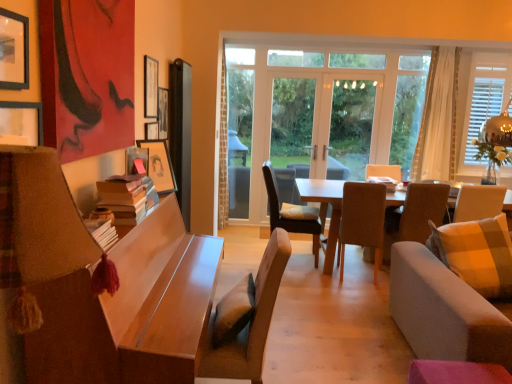
Question: Is white sheer curtain at right positioned in front of wooden picture frame at upper center, positioned as the fourth picture frame in front-to-back order?

Choices:
 (A) no
 (B) yes

Answer: (A)

Question: Does white sheer curtain at right lie behind wooden picture frame at upper center, positioned as the fourth picture frame in front-to-back order?

Choices:
 (A) yes
 (B) no

Answer: (A)

Question: Is white sheer curtain at right located outside wooden picture frame at upper center, positioned as the fourth picture frame in front-to-back order?

Choices:
 (A) yes
 (B) no

Answer: (A)

Question: Does white sheer curtain at right contain wooden picture frame at upper center, which ranks as the 1th picture frame in back-to-front order?

Choices:
 (A) yes
 (B) no

Answer: (B)

Question: Can you confirm if white sheer curtain at right is shorter than wooden picture frame at upper center, positioned as the fourth picture frame in front-to-back order?

Choices:
 (A) no
 (B) yes

Answer: (A)

Question: From a real-world perspective, is white wooden window at right, arranged as the second window when viewed from the left, positioned above or below wooden table at center, the 1th table from the back?

Choices:
 (A) below
 (B) above

Answer: (B)

Question: Is white wooden window at right, which ranks as the first window in right-to-left order, taller or shorter than wooden table at center, the 2th table from the front?

Choices:
 (A) tall
 (B) short

Answer: (A)

Question: Looking at the image, does white wooden window at right, arranged as the second window when viewed from the left, seem bigger or smaller compared to wooden table at center, the 1th table from the back?

Choices:
 (A) big
 (B) small

Answer: (B)

Question: Would you say white wooden window at right, arranged as the second window when viewed from the left, is inside or outside wooden table at center, which is counted as the second table, starting from the left?

Choices:
 (A) inside
 (B) outside

Answer: (B)

Question: Is wooden table at center, which is counted as the 1th table, starting from the right, to the left or to the right of white wooden window at right, arranged as the second window when viewed from the left, in the image?

Choices:
 (A) left
 (B) right

Answer: (A)

Question: Is point (306, 193) closer or farther from the camera than point (490, 104)?

Choices:
 (A) closer
 (B) farther

Answer: (A)

Question: From the image's perspective, relative to white wooden window at right, which ranks as the first window in right-to-left order, is wooden table at center, which is counted as the second table, starting from the left, above or below?

Choices:
 (A) above
 (B) below

Answer: (B)

Question: Is wooden table at center, the 1th table from the back, bigger or smaller than white wooden window at right, arranged as the second window when viewed from the left?

Choices:
 (A) small
 (B) big

Answer: (B)

Question: Is light brown fabric chair at center, the fourth chair in the right-to-left sequence, to the left or to the right of brown fabric chair at center, which is the first chair in back-to-front order, in the image?

Choices:
 (A) left
 (B) right

Answer: (A)

Question: Is light brown fabric chair at center, the fourth chair in the right-to-left sequence, situated inside brown fabric chair at center, the 4th chair in the front-to-back sequence, or outside?

Choices:
 (A) outside
 (B) inside

Answer: (A)